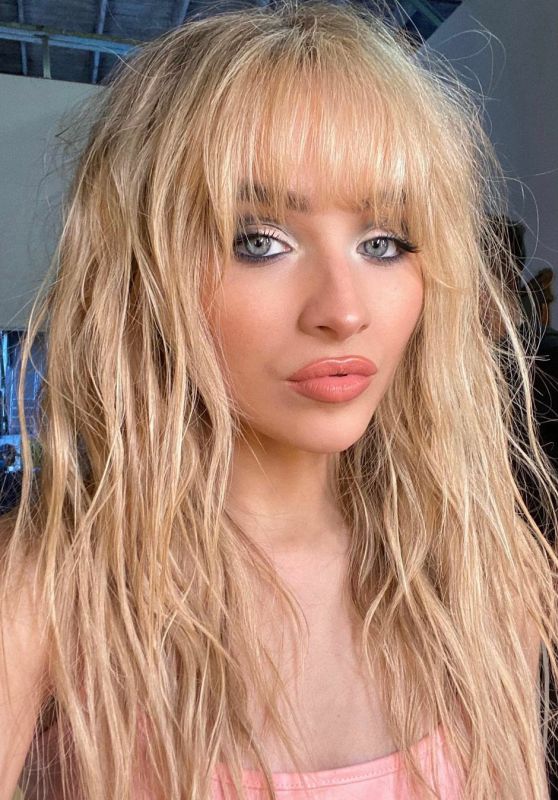
Find the location of a particular element. wall is located at coordinates (31, 180), (540, 98).